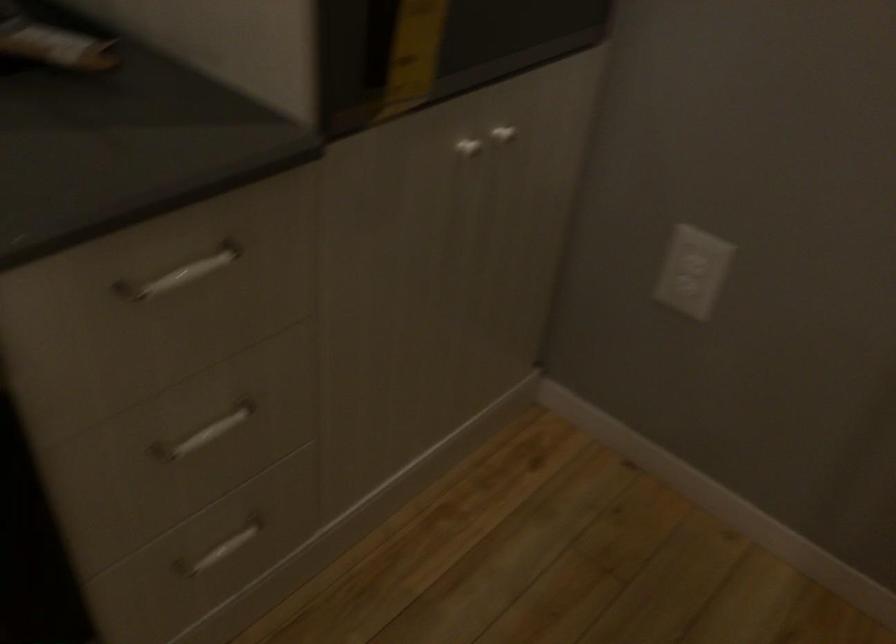
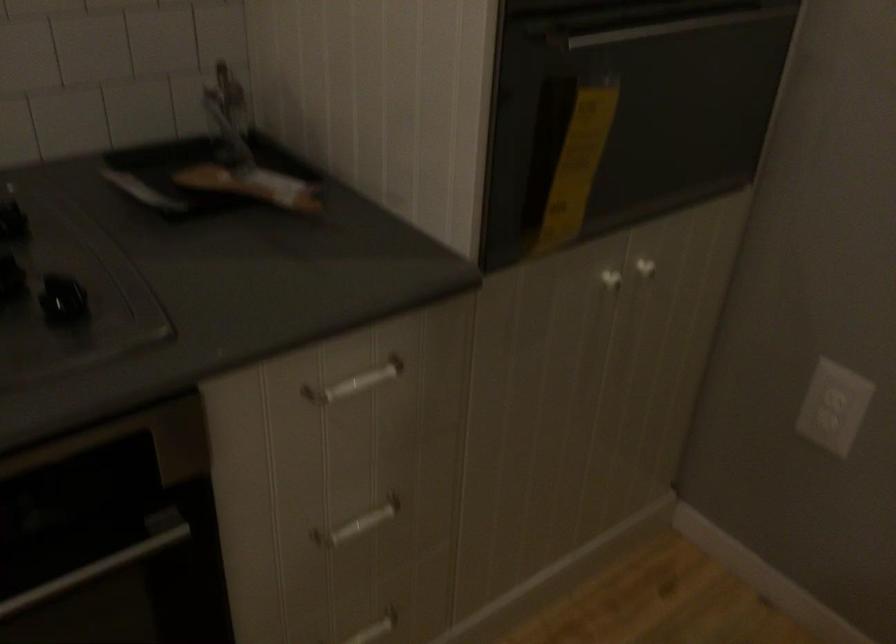
Question: The camera is either moving clockwise (left) or counter-clockwise (right) around the object. The first image is from the beginning of the video and the second image is from the end. Is the camera moving left or right when shooting the video?

Choices:
 (A) Left
 (B) Right

Answer: (B)